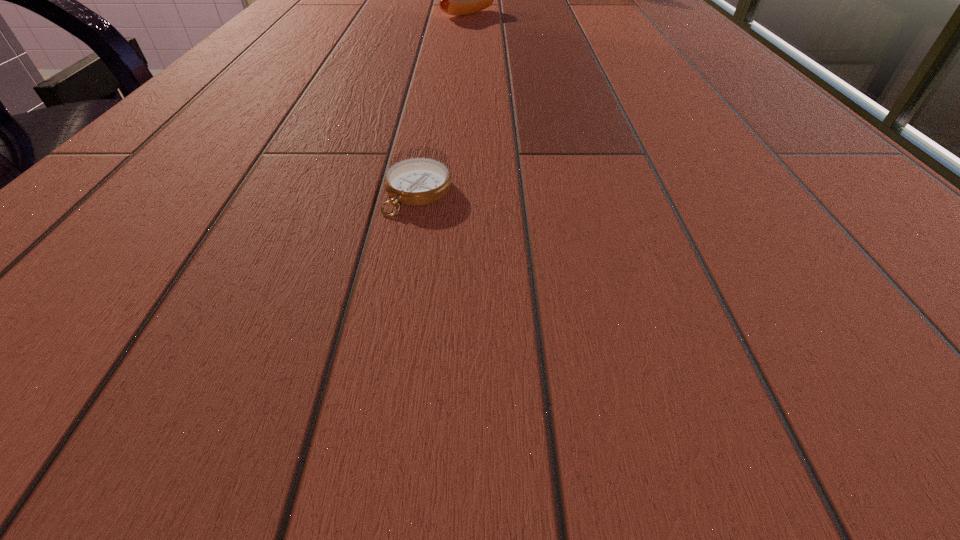
You are a GUI agent. You are given a task and a screenshot of the screen. Output one action in this format:
    pyautogui.click(x=<x>, y=<y>)
    Task: Click on the vacant area between the nearer object and the farther object
    This screenshot has width=960, height=540.
    Given the screenshot: What is the action you would take?
    pyautogui.click(x=443, y=103)